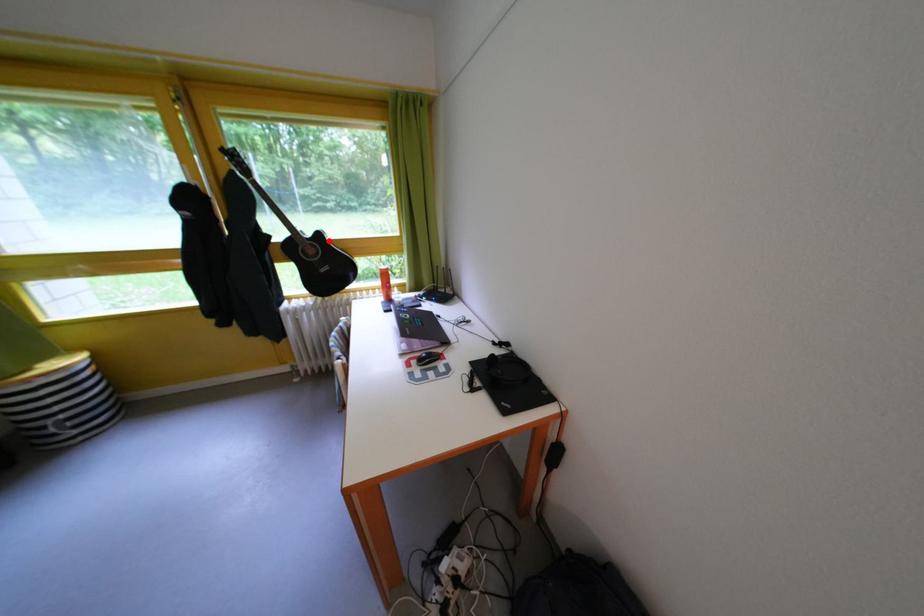
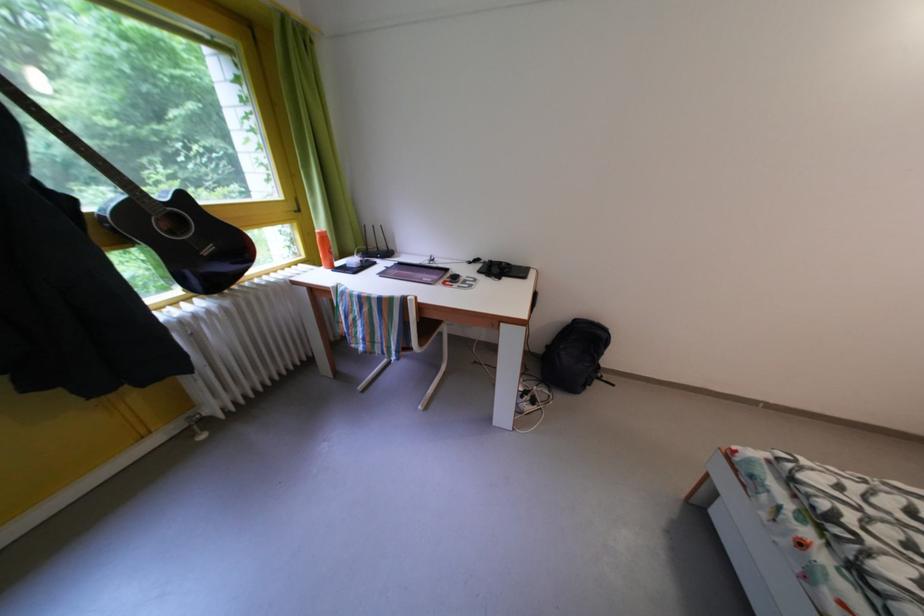
Locate, in the second image, the point that corresponds to the highlighted location in the first image.

(191, 203)